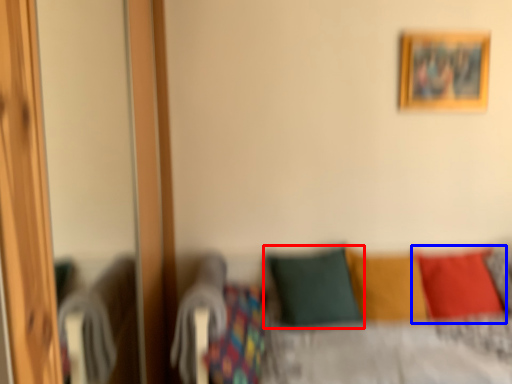
Question: Which of the following is the farthest to the observer, pillow (highlighted by a red box) or pillow (highlighted by a blue box)?

Choices:
 (A) pillow
 (B) pillow

Answer: (B)